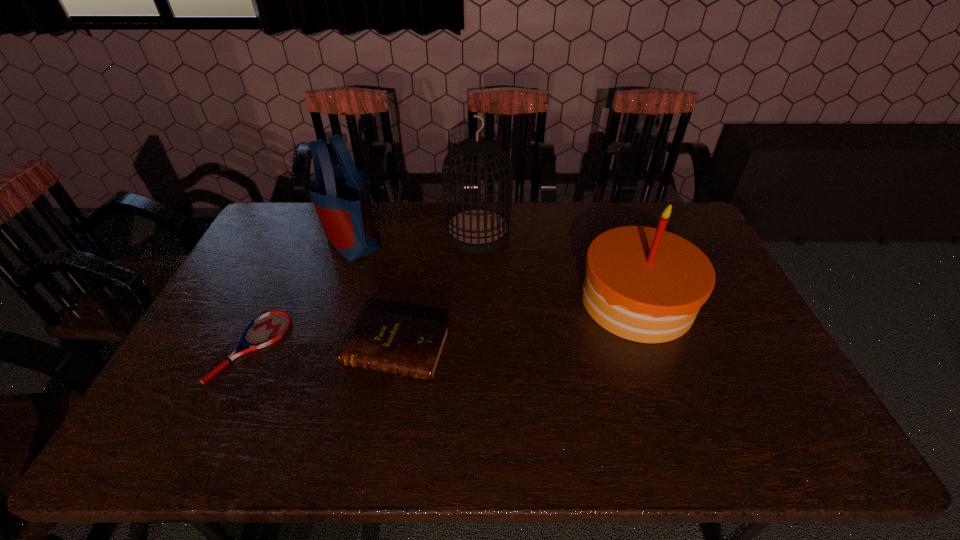
This screenshot has width=960, height=540. I want to click on vacant region between the hardback book and the birthday cake, so click(516, 326).

Where is `free point between the handbag and the fourth tallest object`? The height and width of the screenshot is (540, 960). free point between the handbag and the fourth tallest object is located at coordinates (374, 295).

The width and height of the screenshot is (960, 540). Find the location of `free space that is in between the shortest object and the birdcage`. free space that is in between the shortest object and the birdcage is located at coordinates (365, 291).

The height and width of the screenshot is (540, 960). What are the coordinates of `vacant space that's between the second shortest object and the handbag` in the screenshot? It's located at (374, 295).

Locate an element on the screen. blank region between the rightmost object and the hardback book is located at coordinates (516, 326).

The image size is (960, 540). I want to click on vacant area that lies between the handbag and the birdcage, so click(x=415, y=237).

I want to click on free space between the handbag and the second shortest object, so click(374, 295).

Where is `free space between the shortest object and the hardback book`? free space between the shortest object and the hardback book is located at coordinates (324, 349).

Image resolution: width=960 pixels, height=540 pixels. I want to click on vacant area that lies between the birdcage and the hardback book, so click(437, 293).

Image resolution: width=960 pixels, height=540 pixels. I want to click on object identified as the second closest to the handbag, so click(266, 329).